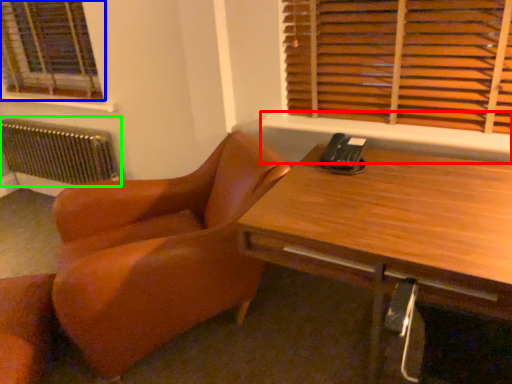
Question: Which is nearer to the window sill (highlighted by a red box)? window (highlighted by a blue box) or radiator (highlighted by a green box).

Choices:
 (A) window
 (B) radiator

Answer: (B)